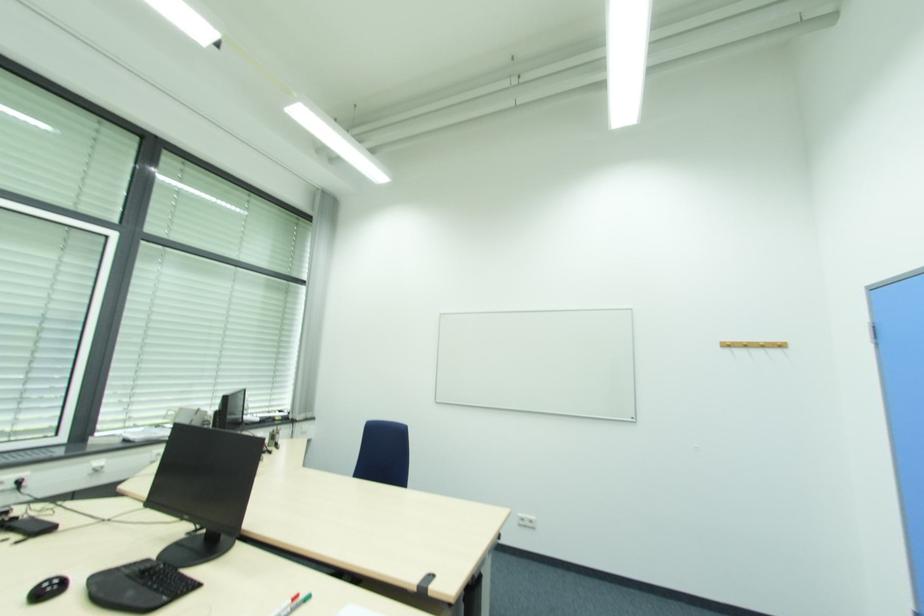
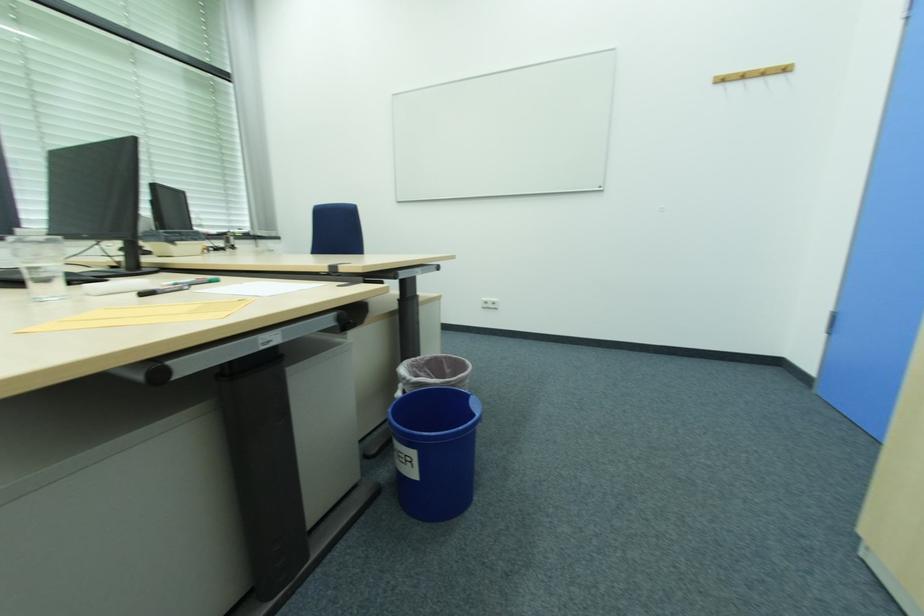
Question: The images are taken continuously from a first-person perspective. In which direction are you moving?

Choices:
 (A) Left
 (B) Right
 (C) Forward
 (D) Backward

Answer: (B)